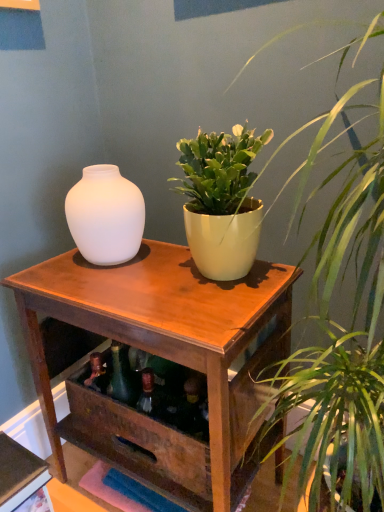
Identify the location of free space above wooden table at center (from a real-world perspective). (122, 282).